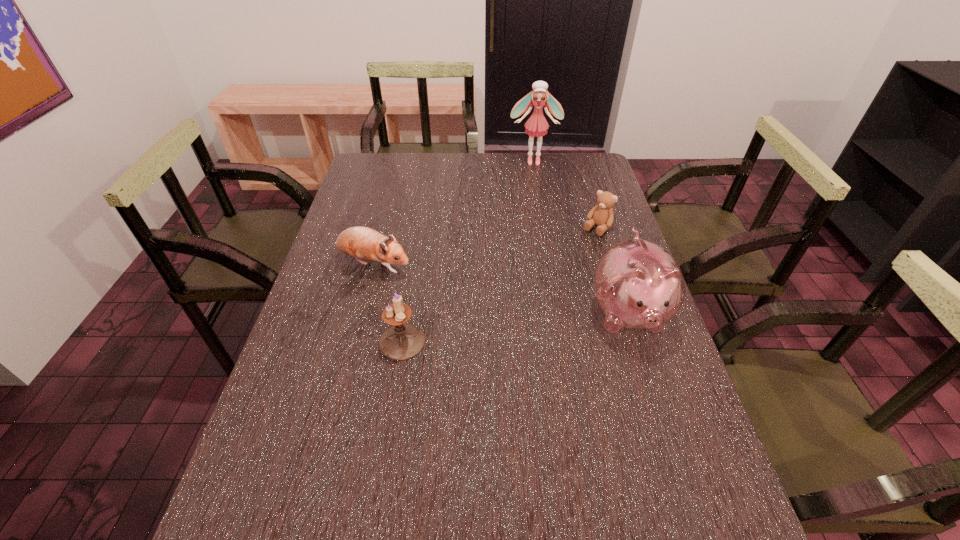
The height and width of the screenshot is (540, 960). What are the coordinates of `blank area in the image that satisfies the following two spatial constraints: 1. on the front side of the candle holder; 2. on the right side of the hamster` in the screenshot? It's located at (353, 342).

Image resolution: width=960 pixels, height=540 pixels. I want to click on free space that satisfies the following two spatial constraints: 1. on the back side of the hamster; 2. on the left side of the farthest object, so click(400, 161).